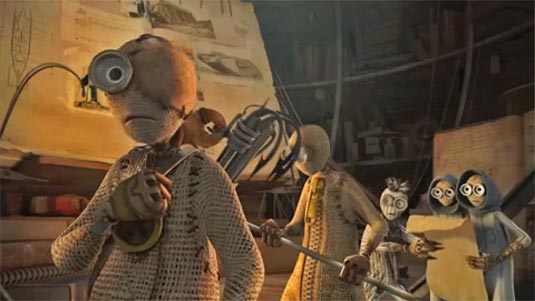
Where is `illuminated area`? Image resolution: width=535 pixels, height=301 pixels. illuminated area is located at coordinates (84, 126).